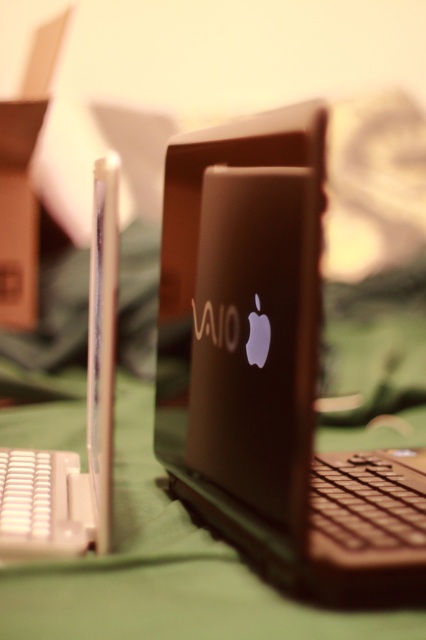
Does satin black laptop at center have a lesser height compared to satin black laptop at left?

No, satin black laptop at center is not shorter than satin black laptop at left.

Who is higher up, satin black laptop at center or satin black laptop at left?

satin black laptop at center is above.

The height and width of the screenshot is (640, 426). Identify the location of satin black laptop at center. (268, 369).